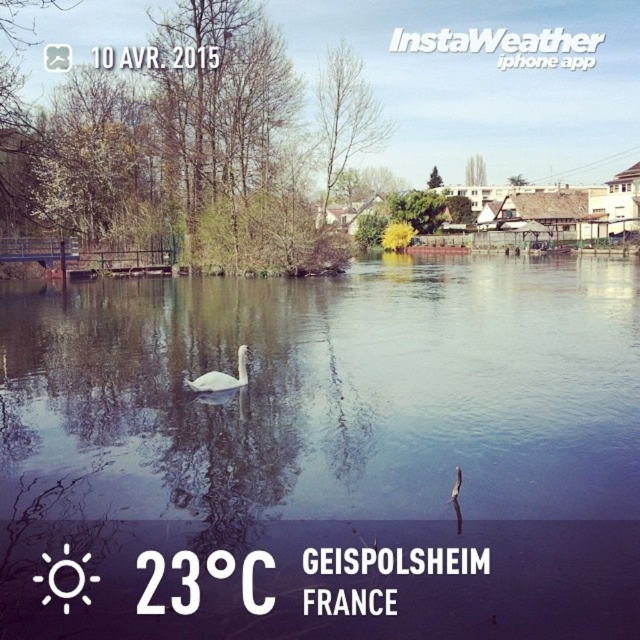
Question: Which point appears closest to the camera in this image?

Choices:
 (A) (212, 381)
 (B) (81, 307)

Answer: (A)

Question: Is clear water at center smaller than white glossy swan at center?

Choices:
 (A) no
 (B) yes

Answer: (A)

Question: Is the position of clear water at center more distant than that of white glossy swan at center?

Choices:
 (A) no
 (B) yes

Answer: (A)

Question: Can you confirm if clear water at center is wider than white glossy swan at center?

Choices:
 (A) yes
 (B) no

Answer: (A)